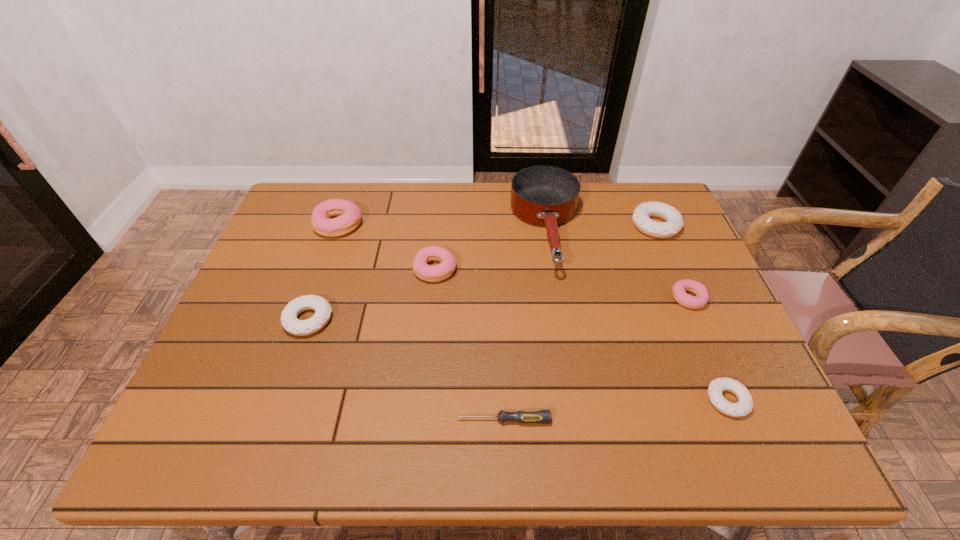
Locate an element on the screen. This screenshot has width=960, height=540. vacant space located on the left of the shortest doughnut is located at coordinates (623, 400).

Identify the location of vacant area situated 0.050m insert the screwdriver into a screw head. (432, 420).

Identify the location of free space located insert the screwdriver into a screw head. The image size is (960, 540). (374, 420).

The width and height of the screenshot is (960, 540). What are the coordinates of `vacant space located 0.080m insert the screwdriver into a screw head` in the screenshot? It's located at (418, 420).

At what (x,y) coordinates should I click in order to perform the action: click on pan situated at the far edge. Please return your answer as a coordinate pair (x, y). This screenshot has width=960, height=540. Looking at the image, I should click on (548, 196).

Where is `doughnut located in the near edge section of the desktop`? doughnut located in the near edge section of the desktop is located at coordinates (744, 406).

At what (x,y) coordinates should I click in order to perform the action: click on screwdriver that is positioned at the near edge. Please return your answer as a coordinate pair (x, y). This screenshot has height=540, width=960. Looking at the image, I should click on (522, 416).

Find the location of a particular element. The height and width of the screenshot is (540, 960). object that is positioned at the far left corner is located at coordinates (349, 215).

The height and width of the screenshot is (540, 960). Identify the location of object present at the far right corner. (674, 223).

Image resolution: width=960 pixels, height=540 pixels. Identify the location of object at the near right corner. (744, 406).